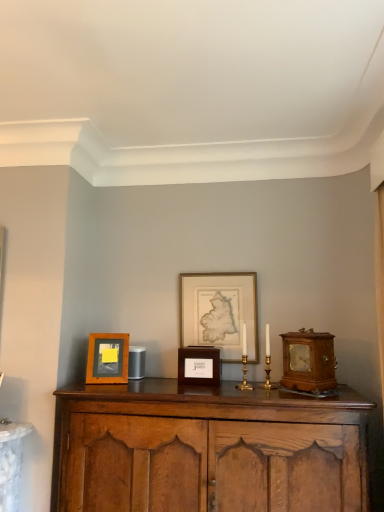
What do you see at coordinates (220, 312) in the screenshot?
I see `gold-framed map at center, which is the first picture frame from right to left` at bounding box center [220, 312].

The width and height of the screenshot is (384, 512). Identify the location of wooden box at center, arranged as the second picture frame when viewed from the left. (199, 366).

Where is `wooden cabinet at center`? This screenshot has width=384, height=512. wooden cabinet at center is located at coordinates (207, 449).

This screenshot has height=512, width=384. I want to click on wooden alarm clock at right, so click(x=308, y=361).

At what (x,y) coordinates should I click in order to perform the action: click on gold-framed map at center, the third picture frame when ordered from left to right. Please return your answer as a coordinate pair (x, y). The image size is (384, 512). Looking at the image, I should click on (220, 312).

Could you tell me if wooden alarm clock at right is turned towards wooden cabinet at center?

No, wooden alarm clock at right is not oriented towards wooden cabinet at center.

Is wooden alarm clock at right spatially inside wooden cabinet at center, or outside of it?

wooden alarm clock at right is located beyond the bounds of wooden cabinet at center.

Locate an element on the screen. The image size is (384, 512). alarm clock on the right of wooden cabinet at center is located at coordinates (308, 361).

Which object is positioned more to the right, wooden alarm clock at right or wooden cabinet at center?

wooden alarm clock at right.

Can you confirm if gold-framed map at center, which is the first picture frame from right to left, is thinner than wooden alarm clock at right?

Correct, the width of gold-framed map at center, which is the first picture frame from right to left, is less than that of wooden alarm clock at right.

From the image's perspective, between gold-framed map at center, the third picture frame when ordered from left to right, and wooden alarm clock at right, which one is located above?

gold-framed map at center, the third picture frame when ordered from left to right, appears higher in the image.

Considering the sizes of objects gold-framed map at center, the third picture frame when ordered from left to right, and wooden alarm clock at right in the image provided, who is taller, gold-framed map at center, the third picture frame when ordered from left to right, or wooden alarm clock at right?

Standing taller between the two is gold-framed map at center, the third picture frame when ordered from left to right.

Identify the location of alarm clock lying below the gold-framed map at center, which is the first picture frame from right to left (from the image's perspective). This screenshot has width=384, height=512. (308, 361).

Is wooden alarm clock at right oriented away from wooden frame at left, the 1th picture frame positioned from the left?

That's not correct — wooden alarm clock at right is not looking away from wooden frame at left, the 1th picture frame positioned from the left.

Does point (291, 338) lie behind point (113, 364)?

No.

Considering the sizes of objects wooden alarm clock at right and wooden frame at left, placed as the third picture frame when sorted from right to left, in the image provided, who is bigger, wooden alarm clock at right or wooden frame at left, placed as the third picture frame when sorted from right to left,?

With larger size is wooden alarm clock at right.

Is wooden alarm clock at right positioned far away from wooden frame at left, placed as the third picture frame when sorted from right to left?

No.

Is wooden cabinet at center positioned far away from gold-framed map at center, which is the first picture frame from right to left?

No, there isn't a large distance between wooden cabinet at center and gold-framed map at center, which is the first picture frame from right to left.

Locate an element on the screen. the 3rd picture frame located above the wooden cabinet at center (from a real-world perspective) is located at coordinates tap(220, 312).

Between wooden cabinet at center and gold-framed map at center, the third picture frame when ordered from left to right, which one has less height?

gold-framed map at center, the third picture frame when ordered from left to right.

Does wooden cabinet at center have a larger size compared to gold-framed map at center, the third picture frame when ordered from left to right?

Yes.

Could you measure the distance between wooden box at center, which is the second picture frame in right-to-left order, and wooden frame at left, placed as the third picture frame when sorted from right to left?

The distance of wooden box at center, which is the second picture frame in right-to-left order, from wooden frame at left, placed as the third picture frame when sorted from right to left, is 14.54 inches.

Looking at this image, from the image's perspective, is wooden box at center, arranged as the second picture frame when viewed from the left, located beneath wooden frame at left, placed as the third picture frame when sorted from right to left?

Yes, from the image's perspective, wooden box at center, arranged as the second picture frame when viewed from the left, is below wooden frame at left, placed as the third picture frame when sorted from right to left.

Is wooden box at center, arranged as the second picture frame when viewed from the left, situated inside wooden frame at left, placed as the third picture frame when sorted from right to left, or outside?

The correct answer is: outside.

Based on their sizes in the image, would you say wooden box at center, arranged as the second picture frame when viewed from the left, is bigger or smaller than wooden frame at left, placed as the third picture frame when sorted from right to left?

In the image, wooden box at center, arranged as the second picture frame when viewed from the left, appears to be larger than wooden frame at left, placed as the third picture frame when sorted from right to left.

This screenshot has height=512, width=384. There is a wooden box at center, which is the second picture frame in right-to-left order. Find the location of `the 2nd picture frame above it (from the image's perspective)`. the 2nd picture frame above it (from the image's perspective) is located at coordinates (220, 312).

From a real-world perspective, is wooden box at center, which is the second picture frame in right-to-left order, positioned above or below gold-framed map at center, the third picture frame when ordered from left to right?

From a real-world perspective, wooden box at center, which is the second picture frame in right-to-left order, is physically below gold-framed map at center, the third picture frame when ordered from left to right.

From the image's perspective, is wooden box at center, which is the second picture frame in right-to-left order, located beneath gold-framed map at center, which is the first picture frame from right to left?

Yes, from the image's perspective, wooden box at center, which is the second picture frame in right-to-left order, is beneath gold-framed map at center, which is the first picture frame from right to left.

From the picture: From a real-world perspective, is wooden cabinet at center over wooden frame at left, placed as the third picture frame when sorted from right to left?

No, from a real-world perspective, wooden cabinet at center is not on top of wooden frame at left, placed as the third picture frame when sorted from right to left.

This screenshot has width=384, height=512. I want to click on the 2nd picture frame behind the wooden cabinet at center, counting from the anchor's position, so click(107, 358).

Which is in front, point (78, 391) or point (125, 334)?

The point (78, 391) is closer.

Which object is closer to the camera, wooden cabinet at center or wooden frame at left, the 1th picture frame positioned from the left?

wooden cabinet at center is in front.

The width and height of the screenshot is (384, 512). I want to click on cabinetry below the wooden alarm clock at right (from a real-world perspective), so pyautogui.click(x=207, y=449).

Where is `alarm clock lying on the right of gold-framed map at center, which is the first picture frame from right to left`? Image resolution: width=384 pixels, height=512 pixels. alarm clock lying on the right of gold-framed map at center, which is the first picture frame from right to left is located at coordinates (308, 361).

Based on their spatial positions, is wooden frame at left, placed as the third picture frame when sorted from right to left, or wooden alarm clock at right further from wooden cabinet at center?

wooden frame at left, placed as the third picture frame when sorted from right to left.

Considering their positions, is wooden box at center, which is the second picture frame in right-to-left order, positioned further to wooden alarm clock at right than wooden cabinet at center?

Based on the image, wooden box at center, which is the second picture frame in right-to-left order, appears to be further to wooden alarm clock at right.

Based on the photo, from the image, which object appears to be farther from wooden frame at left, the 1th picture frame positioned from the left, wooden cabinet at center or wooden alarm clock at right?

Based on the image, wooden alarm clock at right appears to be further to wooden frame at left, the 1th picture frame positioned from the left.

Which object lies nearer to the anchor point wooden frame at left, placed as the third picture frame when sorted from right to left, wooden cabinet at center or wooden box at center, which is the second picture frame in right-to-left order?

Among the two, wooden box at center, which is the second picture frame in right-to-left order, is located nearer to wooden frame at left, placed as the third picture frame when sorted from right to left.

Estimate the real-world distances between objects in this image. Which object is closer to wooden box at center, arranged as the second picture frame when viewed from the left, wooden cabinet at center or gold-framed map at center, the third picture frame when ordered from left to right?

gold-framed map at center, the third picture frame when ordered from left to right.

Estimate the real-world distances between objects in this image. Which object is closer to wooden box at center, which is the second picture frame in right-to-left order, wooden frame at left, the 1th picture frame positioned from the left, or wooden cabinet at center?

wooden frame at left, the 1th picture frame positioned from the left, lies closer to wooden box at center, which is the second picture frame in right-to-left order, than the other object.

Which object lies further to the anchor point wooden box at center, arranged as the second picture frame when viewed from the left, gold-framed map at center, the third picture frame when ordered from left to right, or wooden cabinet at center?

Based on the image, wooden cabinet at center appears to be further to wooden box at center, arranged as the second picture frame when viewed from the left.

Estimate the real-world distances between objects in this image. Which object is closer to wooden alarm clock at right, wooden box at center, which is the second picture frame in right-to-left order, or gold-framed map at center, which is the first picture frame from right to left?

wooden box at center, which is the second picture frame in right-to-left order, lies closer to wooden alarm clock at right than the other object.

Image resolution: width=384 pixels, height=512 pixels. Find the location of `picture frame between wooden frame at left, the 1th picture frame positioned from the left, and gold-framed map at center, which is the first picture frame from right to left, from left to right`. picture frame between wooden frame at left, the 1th picture frame positioned from the left, and gold-framed map at center, which is the first picture frame from right to left, from left to right is located at coordinates (199, 366).

Locate an element on the screen. alarm clock positioned between wooden cabinet at center and gold-framed map at center, the third picture frame when ordered from left to right, from near to far is located at coordinates (308, 361).

Image resolution: width=384 pixels, height=512 pixels. In order to click on cabinetry situated between wooden frame at left, the 1th picture frame positioned from the left, and wooden alarm clock at right from left to right in this screenshot , I will do `click(207, 449)`.

The image size is (384, 512). Identify the location of picture frame located between wooden cabinet at center and wooden frame at left, placed as the third picture frame when sorted from right to left, in the depth direction. (199, 366).